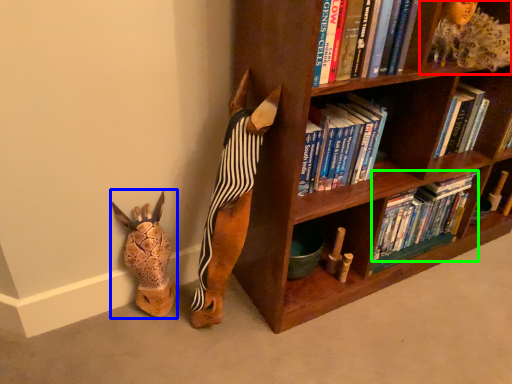
Question: Which is nearer to the shelf (highlighted by a red box)? animal (highlighted by a blue box) or book (highlighted by a green box).

Choices:
 (A) animal
 (B) book

Answer: (B)